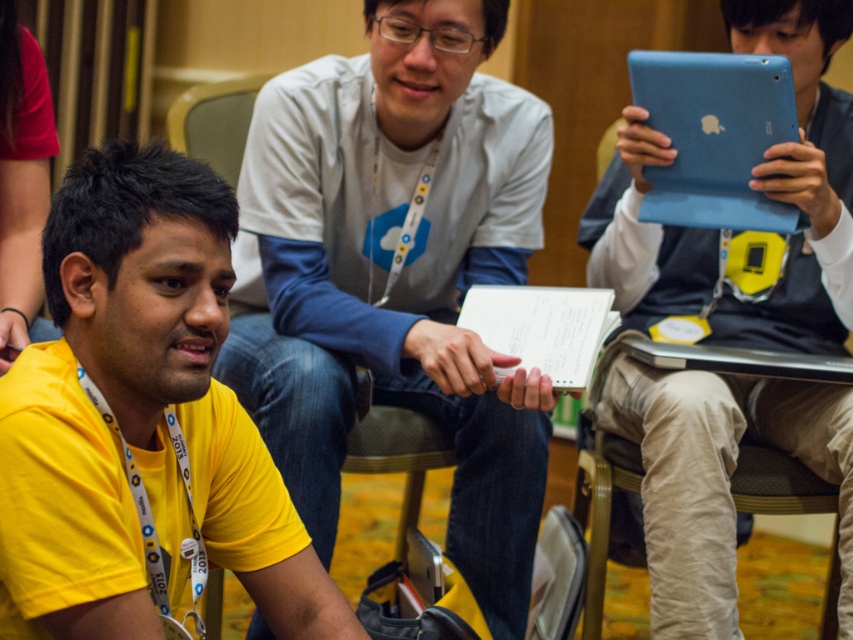
Question: Can you confirm if blue matte tablet at center is positioned above blue matte tablet at upper right?

Choices:
 (A) yes
 (B) no

Answer: (B)

Question: Which object appears farthest from the camera in this image?

Choices:
 (A) blue matte tablet at upper right
 (B) white matte shirt at center
 (C) yellow t-shirt at center

Answer: (B)

Question: Can you confirm if white matte shirt at center is positioned above blue matte tablet at center?

Choices:
 (A) no
 (B) yes

Answer: (A)

Question: Considering the relative positions of blue matte tablet at center and blue matte tablet at upper right in the image provided, where is blue matte tablet at center located with respect to blue matte tablet at upper right?

Choices:
 (A) above
 (B) below

Answer: (B)

Question: Which of these objects is positioned farthest from the white matte shirt at center?

Choices:
 (A) blue matte tablet at center
 (B) yellow t-shirt at center
 (C) blue matte tablet at upper right

Answer: (B)

Question: Among these objects, which one is farthest from the camera?

Choices:
 (A) blue matte tablet at center
 (B) blue matte tablet at upper right

Answer: (B)